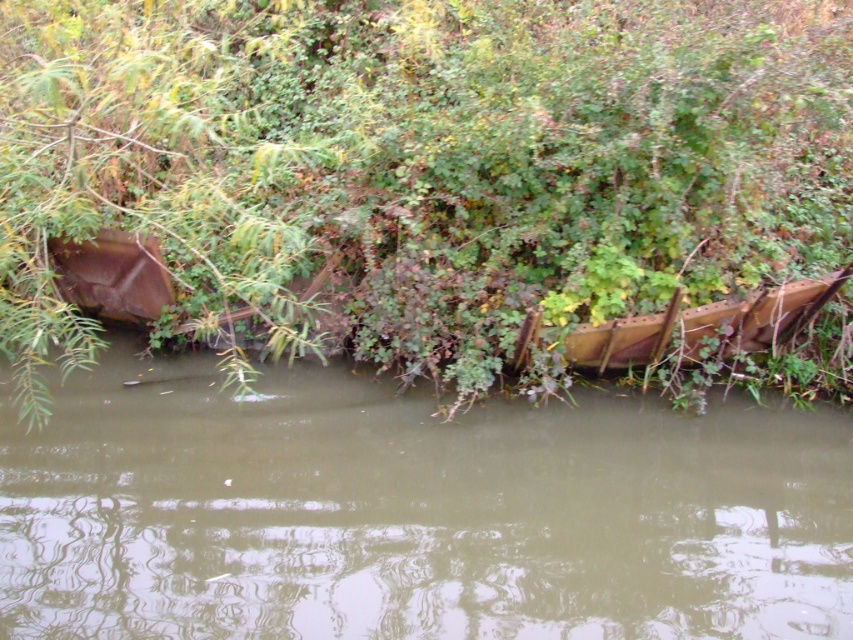
Question: Which point is farther to the camera?

Choices:
 (A) (515, 355)
 (B) (544, 150)

Answer: (A)

Question: Which point appears closest to the camera in this image?

Choices:
 (A) (758, 29)
 (B) (585, 340)

Answer: (A)

Question: Does green matte tree at upper left have a larger size compared to brown wooden boat at center?

Choices:
 (A) no
 (B) yes

Answer: (A)

Question: Is green matte tree at upper left wider than brown wooden boat at center?

Choices:
 (A) yes
 (B) no

Answer: (B)

Question: Does green matte tree at upper left have a greater width compared to brown wooden boat at center?

Choices:
 (A) yes
 (B) no

Answer: (B)

Question: Among these objects, which one is farthest from the camera?

Choices:
 (A) green matte tree at upper left
 (B) rusty metal boat at center
 (C) brown wooden boat at center

Answer: (C)